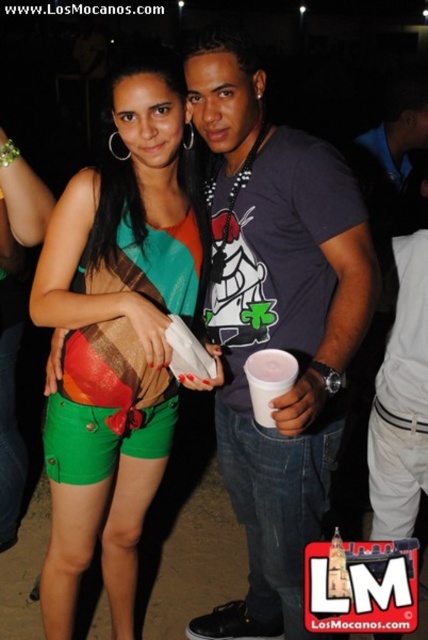
Question: Can you confirm if green cotton shorts at lower left is positioned to the right of white plastic cup at center?

Choices:
 (A) no
 (B) yes

Answer: (A)

Question: Considering the real-world distances, which object is closest to the dark gray t-shirt at center?

Choices:
 (A) white plastic cup at center
 (B) green cotton shorts at lower left

Answer: (B)

Question: Based on their relative distances, which object is farther from the white plastic cup at center?

Choices:
 (A) green cotton shorts at lower left
 (B) dark gray t-shirt at center

Answer: (A)

Question: Can you confirm if dark gray t-shirt at center is thinner than green cotton shorts at lower left?

Choices:
 (A) no
 (B) yes

Answer: (B)

Question: Which object appears closest to the camera in this image?

Choices:
 (A) dark gray t-shirt at center
 (B) white plastic cup at center
 (C) green cotton shorts at lower left

Answer: (A)

Question: Is dark gray t-shirt at center positioned before white plastic cup at center?

Choices:
 (A) yes
 (B) no

Answer: (A)